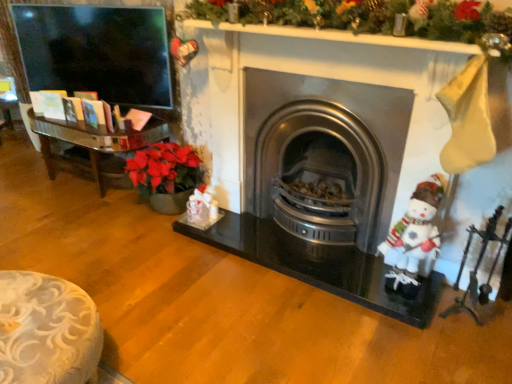
The width and height of the screenshot is (512, 384). Identify the location of space that is in front of white fabric santa claus at right. (409, 331).